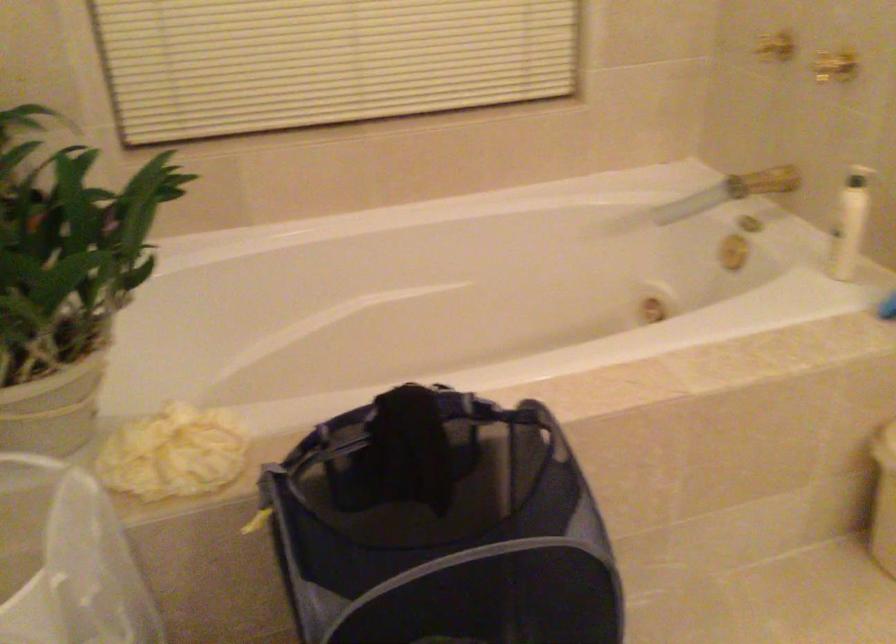
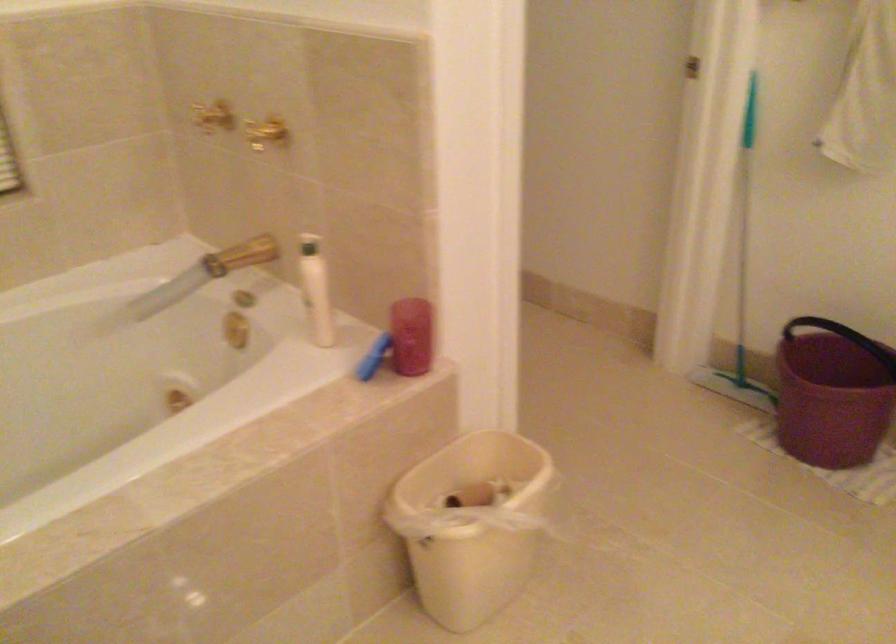
Question: Based on the continuous images, in which direction is the camera rotating? Reply with the corresponding letter.

Choices:
 (A) Left
 (B) Right
 (C) Up
 (D) Down

Answer: (B)